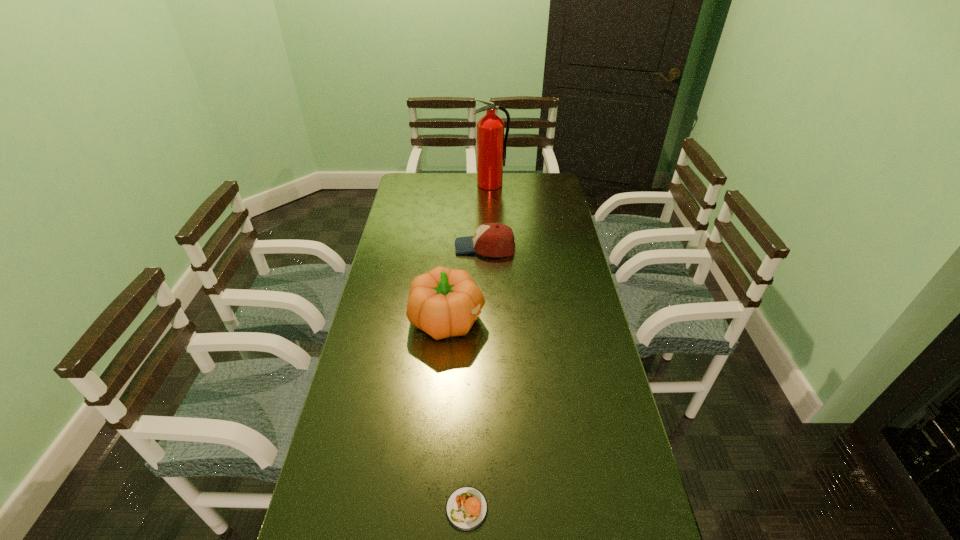
Locate an element on the screen. The height and width of the screenshot is (540, 960). fire extinguisher is located at coordinates (491, 145).

You are a GUI agent. You are given a task and a screenshot of the screen. Output one action in this format:
    pyautogui.click(x=<x>, y=<y>)
    Task: Click on the farthest object
    
    Given the screenshot: What is the action you would take?
    point(491,145)

Locate an element on the screen. pumpkin is located at coordinates (443, 302).

At what (x,y) coordinates should I click in order to perform the action: click on the third shortest object. Please return your answer as a coordinate pair (x, y). Looking at the image, I should click on (443, 302).

Where is `the second shortest object`? The width and height of the screenshot is (960, 540). the second shortest object is located at coordinates (490, 239).

This screenshot has height=540, width=960. Identify the location of the third nearest object. (490, 239).

At what (x,y) coordinates should I click in order to perform the action: click on the shortest object. Please return your answer as a coordinate pair (x, y). This screenshot has height=540, width=960. Looking at the image, I should click on (466, 508).

Where is `patty`? The image size is (960, 540). patty is located at coordinates (466, 508).

This screenshot has height=540, width=960. I want to click on free space located at the nozzle of the farthest object, so pos(492,198).

Find the location of a particular element. Image resolution: width=960 pixels, height=540 pixels. vacant space situated 0.160m on the carved face of the second tallest object is located at coordinates (534, 319).